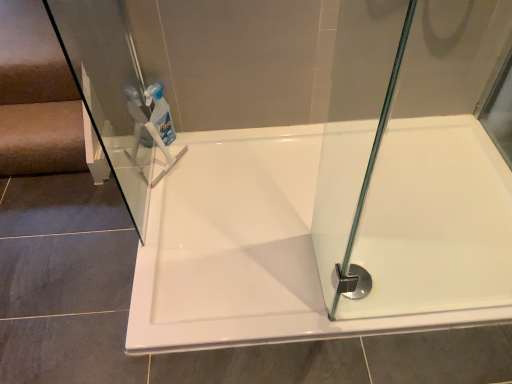
In order to click on free location to the left of polished chrome shower at bottom right in this screenshot , I will do `click(296, 278)`.